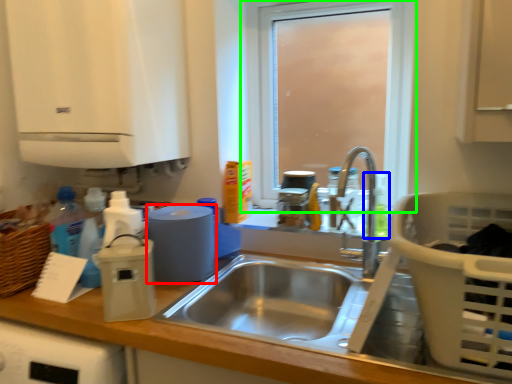
Question: Based on their relative distances, which object is farther from appliance (highlighted by a red box)? Choose from bottle (highlighted by a blue box) and window (highlighted by a green box).

Choices:
 (A) bottle
 (B) window

Answer: (B)